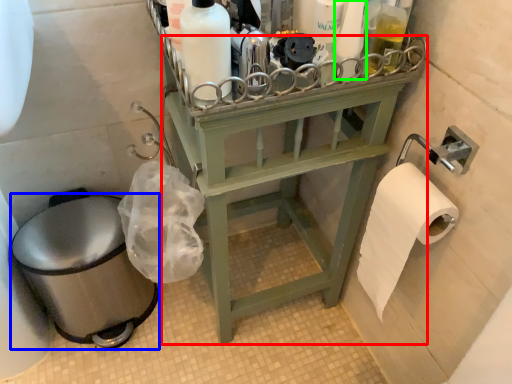
Question: Which object is the farthest from furniture (highlighted by a red box)? Choose among these: toilet bowl (highlighted by a blue box) or toiletry (highlighted by a green box).

Choices:
 (A) toilet bowl
 (B) toiletry

Answer: (B)